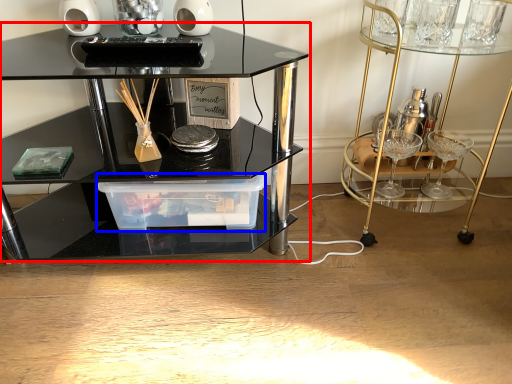
Question: Which object is closer to the camera taking this photo, table (highlighted by a red box) or glass box (highlighted by a blue box)?

Choices:
 (A) table
 (B) glass box

Answer: (A)